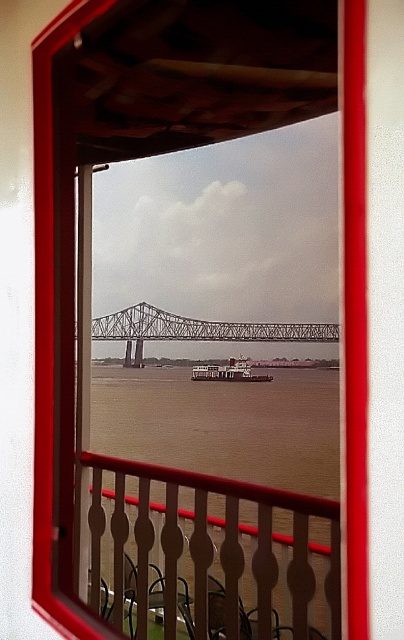
Who is lower down, brown wood railing at center or metallic gray bridge at center?

brown wood railing at center is lower down.

Consider the image. Can you confirm if brown wood railing at center is bigger than metallic gray bridge at center?

Yes, brown wood railing at center is bigger than metallic gray bridge at center.

This screenshot has height=640, width=404. What do you see at coordinates (206, 556) in the screenshot?
I see `brown wood railing at center` at bounding box center [206, 556].

The height and width of the screenshot is (640, 404). I want to click on brown wood railing at center, so click(206, 556).

I want to click on brown wood railing at center, so click(206, 556).

Which is below, brown wood railing at center or white matte barge at center?

brown wood railing at center is below.

Between point (309, 556) and point (202, 371), which one is positioned in front?

Point (309, 556) is in front.

At what (x,y) coordinates should I click in order to perform the action: click on brown wood railing at center. Please return your answer as a coordinate pair (x, y). This screenshot has height=640, width=404. Looking at the image, I should click on (206, 556).

Where is `metallic gray bridge at center`? The image size is (404, 640). metallic gray bridge at center is located at coordinates (201, 330).

Does metallic gray bridge at center have a greater width compared to white matte barge at center?

Yes.

Which is in front, point (195, 339) or point (208, 365)?

Point (208, 365)

Locate an element on the screen. This screenshot has height=640, width=404. metallic gray bridge at center is located at coordinates (201, 330).